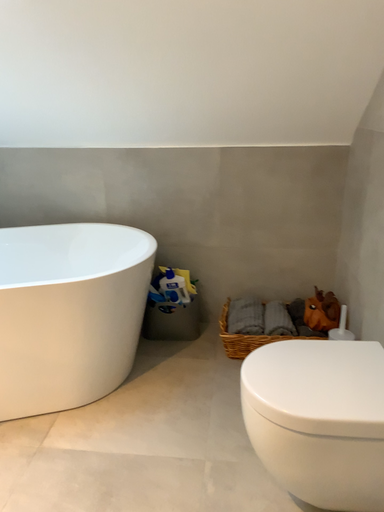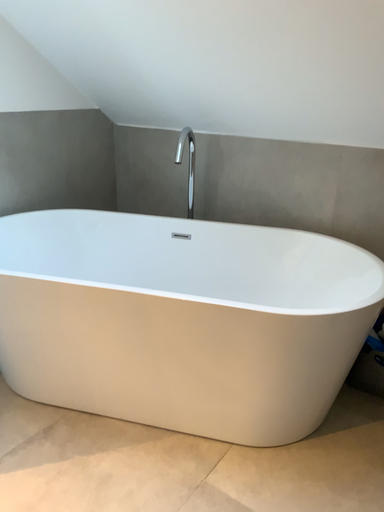
Question: How did the camera likely rotate when shooting the video?

Choices:
 (A) rotated right
 (B) rotated left

Answer: (B)